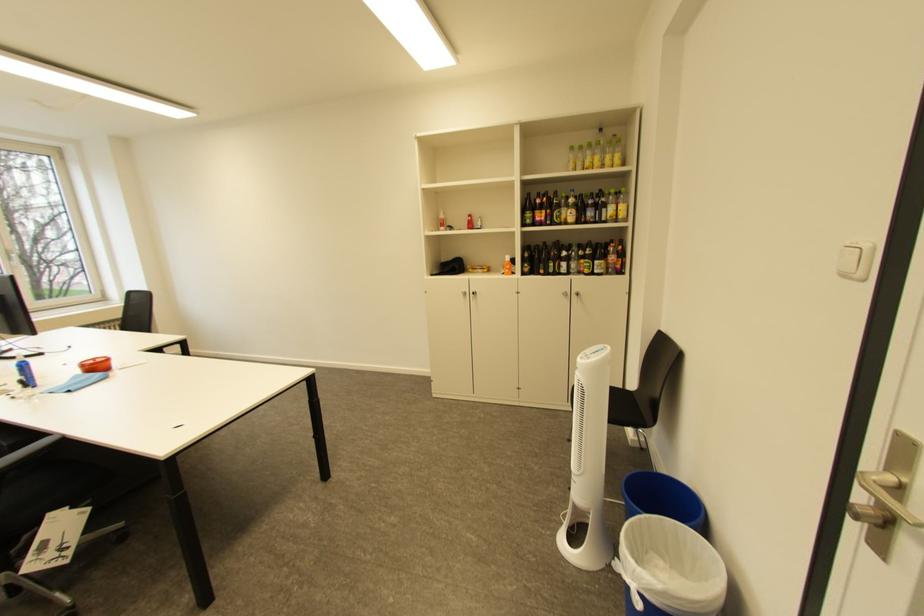
At what (x,y) coordinates should I click in order to perform the action: click on white light switch. Please return your answer as a coordinate pair (x, y). This screenshot has height=616, width=924. Looking at the image, I should click on [x=855, y=261].